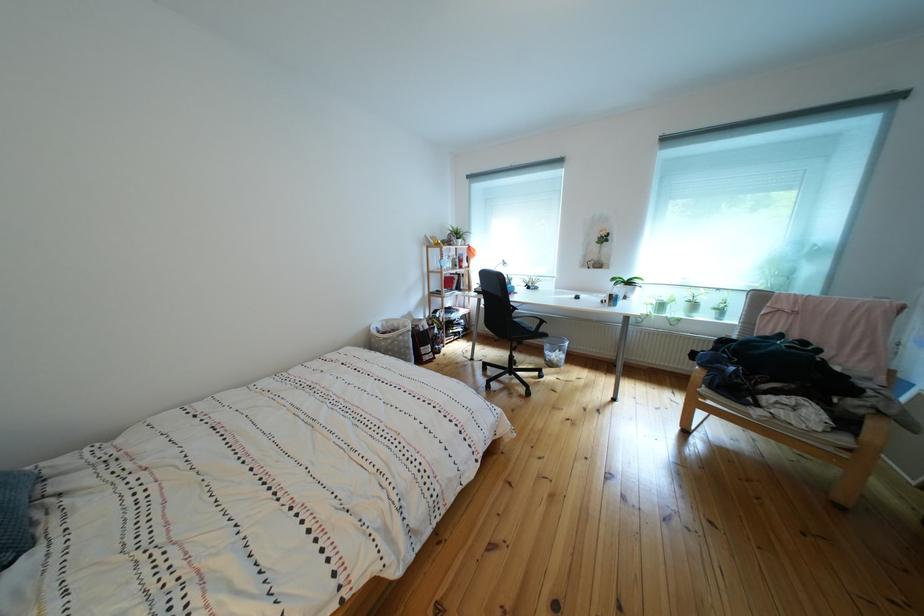
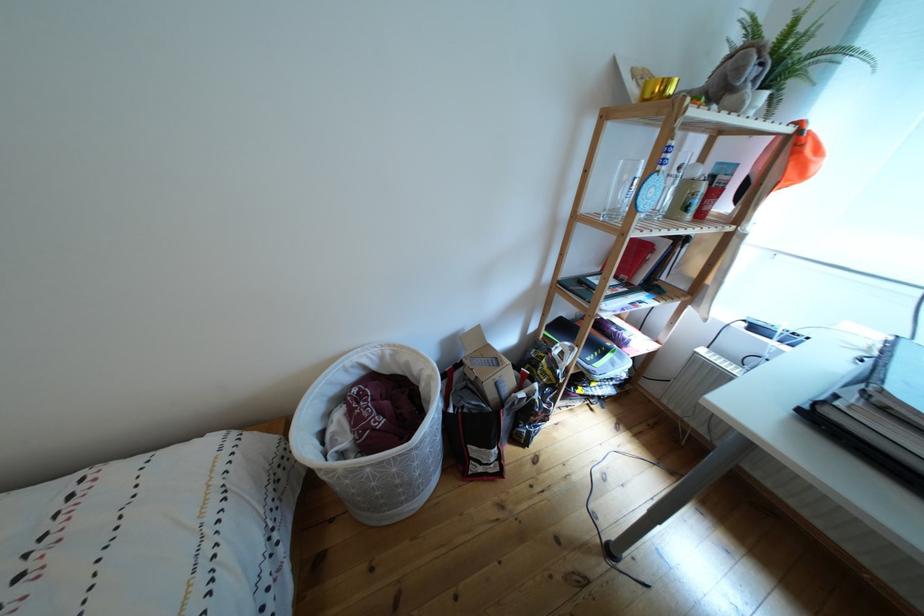
Where in the second image is the point corresponding to (x=394, y=331) from the first image?

(393, 363)